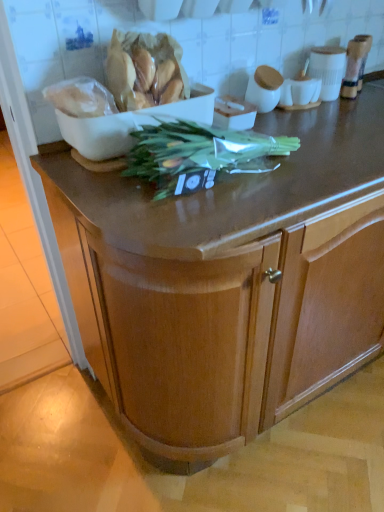
At what (x,y) coordinates should I click in order to perform the action: click on free spot to the right of green leafy vegetable at center. Please return your answer as a coordinate pair (x, y). Looking at the image, I should click on (x=321, y=161).